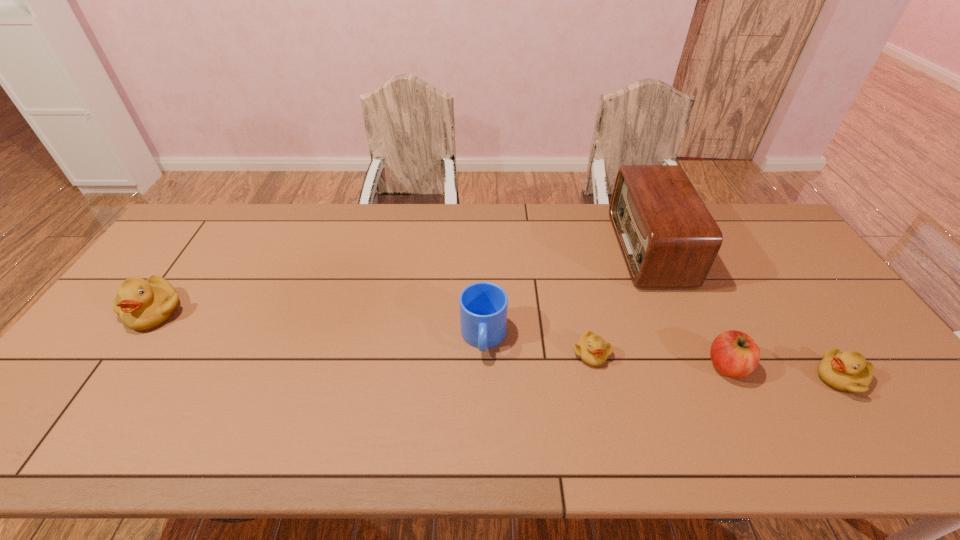
Locate an element on the screen. the leftmost duckling is located at coordinates (142, 304).

What are the coordinates of `the leftmost object` in the screenshot? It's located at (142, 304).

At what (x,y) coordinates should I click in order to perform the action: click on the second duckling from right to left. Please return your answer as a coordinate pair (x, y). Looking at the image, I should click on (592, 350).

What are the coordinates of `the shortest object` in the screenshot? It's located at (592, 350).

You are a GUI agent. You are given a task and a screenshot of the screen. Output one action in this format:
    pyautogui.click(x=<x>, y=<y>)
    Task: Click on the rightmost object
    The image size is (960, 540).
    Given the screenshot: What is the action you would take?
    pyautogui.click(x=848, y=371)

Locate an element on the screen. The width and height of the screenshot is (960, 540). the fifth tallest object is located at coordinates (848, 371).

Locate an element on the screen. The image size is (960, 540). the tallest object is located at coordinates (668, 238).

Find the location of a particular element. This screenshot has width=960, height=540. the fifth object from right to left is located at coordinates (483, 305).

Find the location of a particular element. This screenshot has height=540, width=960. apple is located at coordinates (733, 353).

The width and height of the screenshot is (960, 540). I want to click on vacant area located 0.190m at the beak of the farthest duckling, so [x=95, y=396].